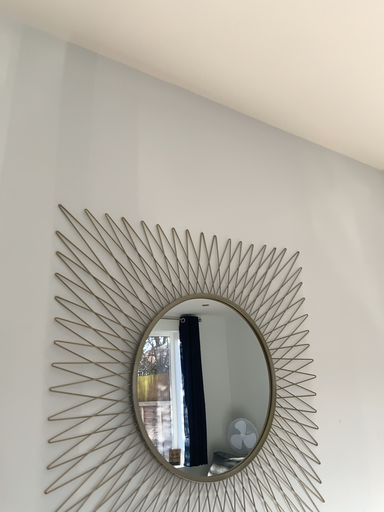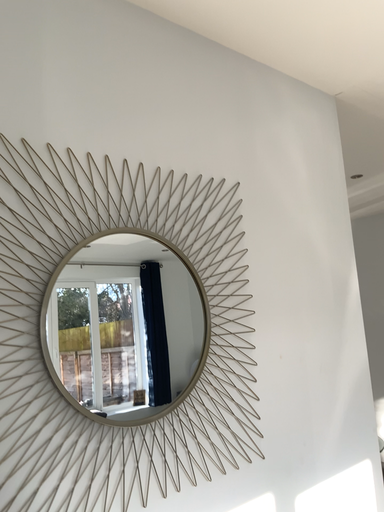
Question: How did the camera likely rotate when shooting the video?

Choices:
 (A) rotated upward
 (B) rotated downward

Answer: (B)